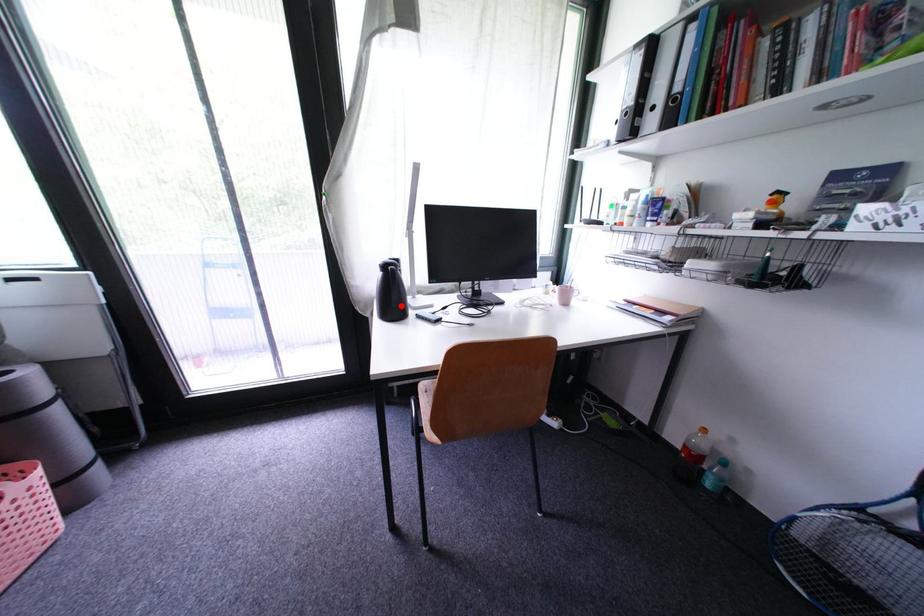
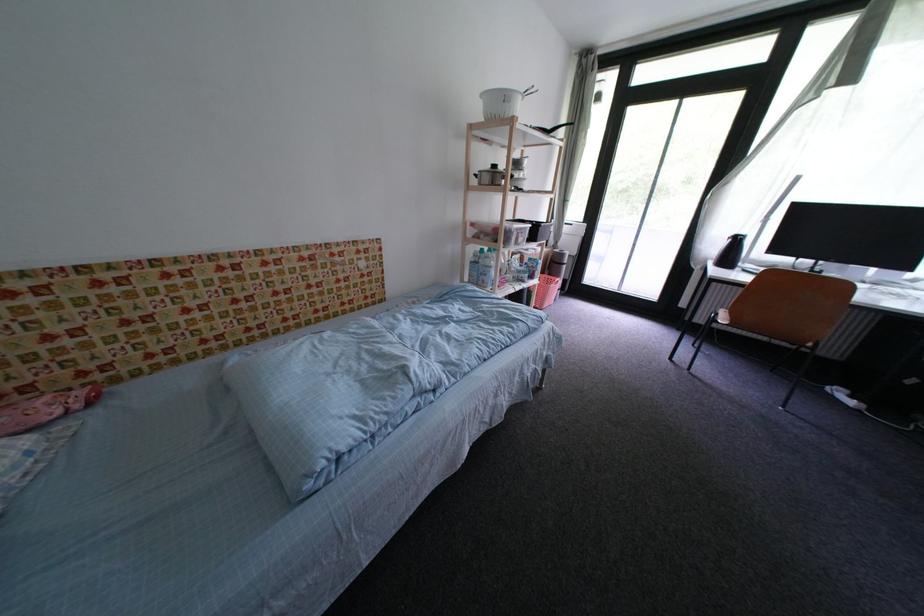
Question: I am providing you with two images of the same scene from different viewpoints. In image1, a red point is highlighted. Considering the same 3D point in image2, which of the following is correct?

Choices:
 (A) It is closer
 (B) It is farther

Answer: (B)